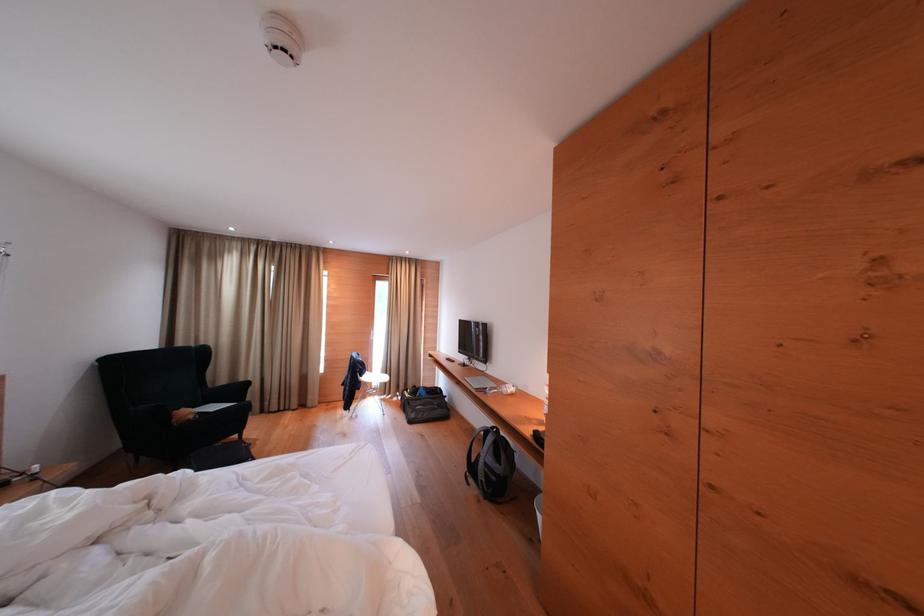
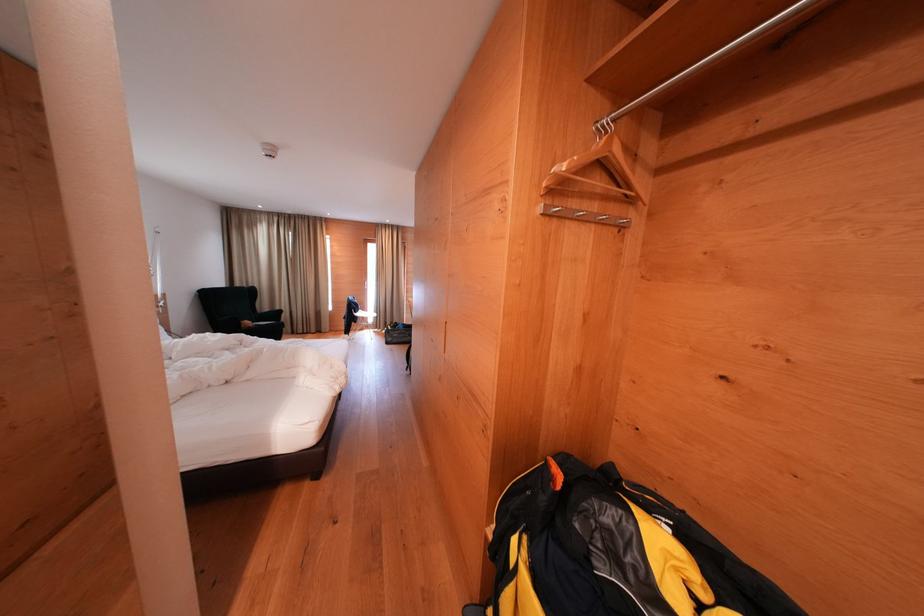
Locate, in the second image, the point that corresponds to point 383,379 in the first image.

(374, 318)